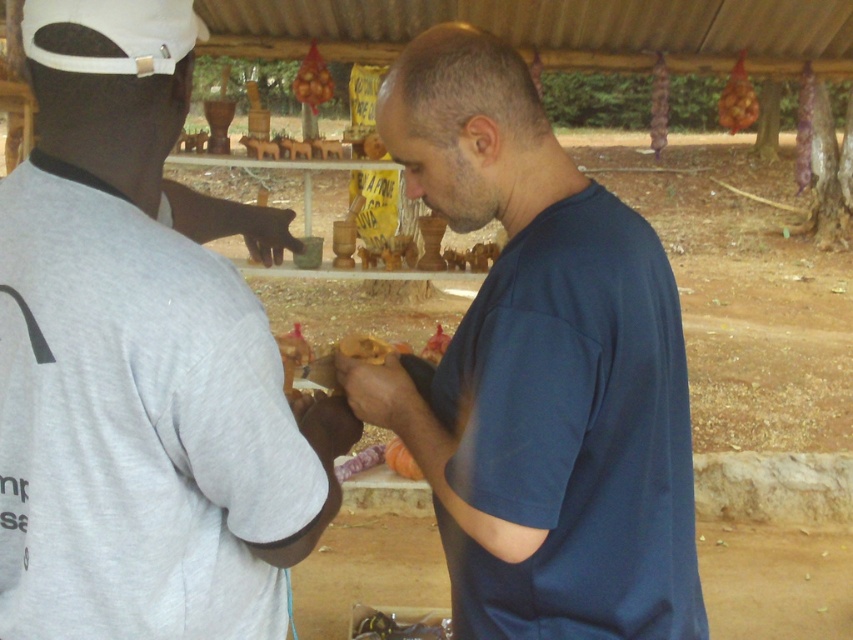
Question: Can you confirm if blue cotton shirt at center is positioned to the right of smooth orange fruit at center?

Choices:
 (A) no
 (B) yes

Answer: (B)

Question: Which object appears farthest from the camera in this image?

Choices:
 (A) blue cotton shirt at center
 (B) smooth orange fruit at center

Answer: (B)

Question: Does gray matte shirt at left have a larger size compared to blue cotton shirt at center?

Choices:
 (A) no
 (B) yes

Answer: (A)

Question: Among these objects, which one is farthest from the camera?

Choices:
 (A) gray matte shirt at left
 (B) blue cotton shirt at center

Answer: (B)

Question: Which of the following is the farthest from the observer?

Choices:
 (A) (143, 307)
 (B) (361, 419)
 (C) (396, 444)

Answer: (C)

Question: Does gray matte shirt at left have a larger size compared to smooth orange fruit at center?

Choices:
 (A) no
 (B) yes

Answer: (B)